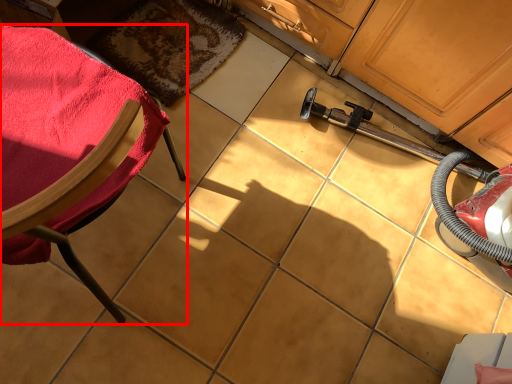
Question: From the image's perspective, considering the relative positions of chair (annotated by the red box) and mat in the image provided, where is chair (annotated by the red box) located with respect to the staircase?

Choices:
 (A) above
 (B) below

Answer: (B)